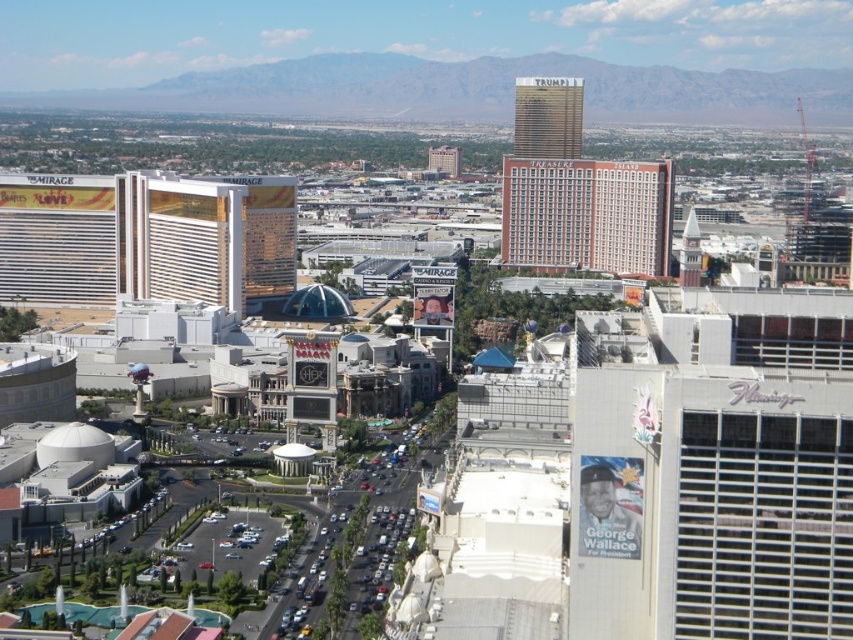
You are a tourist standing on the sidewalk in front of the Trump International Hotel and Tower. You see a white metal flamingo at upper center and a beige brick building at center. Which object is closer to you?

The white metal flamingo at upper center is closer to you because it is in front of the beige brick building at center.

You are a tourist standing on the sidewalk in front of the Mirage Hotel and Casino. You see the white metal flamingo at upper center and the beige brick building at center. Which of these two objects is located to the left of the other?

The white metal flamingo at upper center is positioned on the left side of beige brick building at center.

You are a tourist standing on the sidewalk and see the white metal flamingo at upper center and the gold reflective hotel at left. Which object is closer to you?

The white metal flamingo at upper center is closer to you because it is in front of the gold reflective hotel at left.